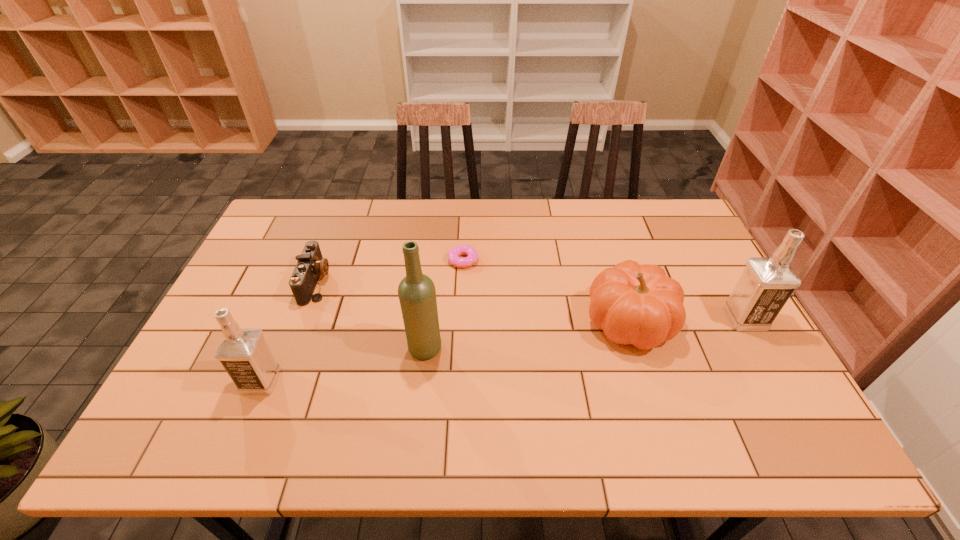
Identify the location of empty location between the shorter vodka and the farther vodka. (503, 349).

Locate an element on the screen. empty location between the wine bottle and the camera is located at coordinates (371, 315).

At what (x,y) coordinates should I click in order to perform the action: click on object that stands as the closest to the wine bottle. Please return your answer as a coordinate pair (x, y). Looking at the image, I should click on (453, 255).

Identify which object is the closest to the pumpkin. Please provide its 2D coordinates. Your answer should be formatted as a tuple, i.e. [(x, y)], where the tuple contains the x and y coordinates of a point satisfying the conditions above.

[(765, 285)]

Find the location of `vacant point that satisfies the following two spatial constraints: 1. on the back side of the fourth tallest object; 2. on the front-facing side of the fifth tallest object`. vacant point that satisfies the following two spatial constraints: 1. on the back side of the fourth tallest object; 2. on the front-facing side of the fifth tallest object is located at coordinates (617, 282).

In order to click on free space that satisfies the following two spatial constraints: 1. on the back side of the fifth object from left to right; 2. on the front-facing side of the camera in this screenshot , I will do `click(617, 282)`.

Locate an element on the screen. This screenshot has width=960, height=540. free space that satisfies the following two spatial constraints: 1. on the front-facing side of the fifth tallest object; 2. on the right side of the wine bottle is located at coordinates tap(291, 348).